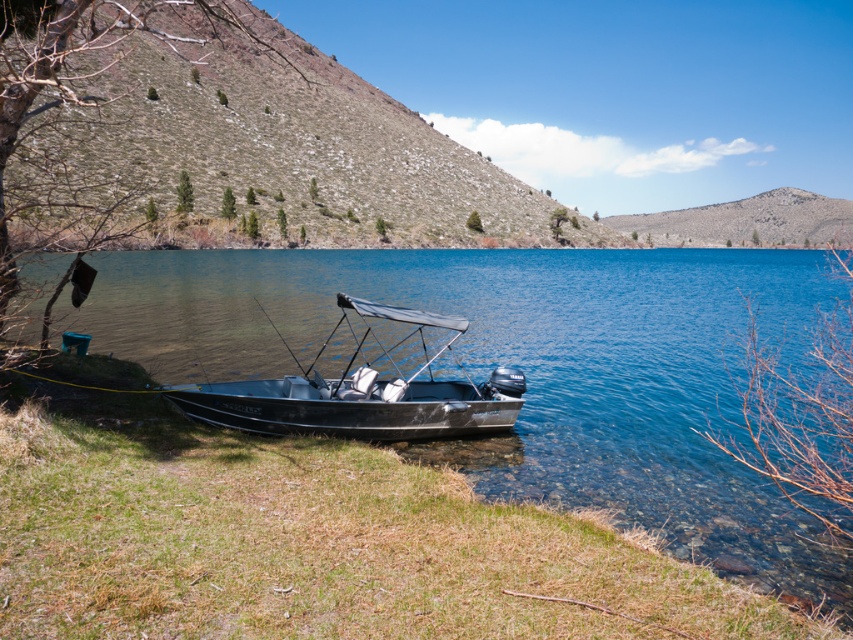
You are planning to place a small decorative stone that is 10 cm wide next to the dull gray rock at upper center. Can the clear blue water at lower left accommodate the stone if you want to place it there instead?

The clear blue water at lower left has a width less than the dull gray rock at upper center. Since the stone is 10 cm wide, and the water area is narrower than the rock, it might not have enough space. Check the exact dimensions before placing the stone there.

You are standing at the lakeside and want to take a photo of the metallic gray boat at lower center. To include the green grassy hillside at upper left in the frame, should you zoom in or zoom out?

You should zoom out to include both the metallic gray boat at lower center and the green grassy hillside at upper left in the frame since the green grassy hillside at upper left is to the left of the metallic gray boat at lower center.

Based on the photo, you are standing on the lakeside path and want to take a photo of the clear blue water at lower left and the green grassy hillside at upper left. Which object should you point your camera towards first to capture both in the same frame?

You should point your camera towards the green grassy hillside at upper left first because it is higher up, allowing you to include both the green grassy hillside at upper left and the clear blue water at lower left in the same frame.